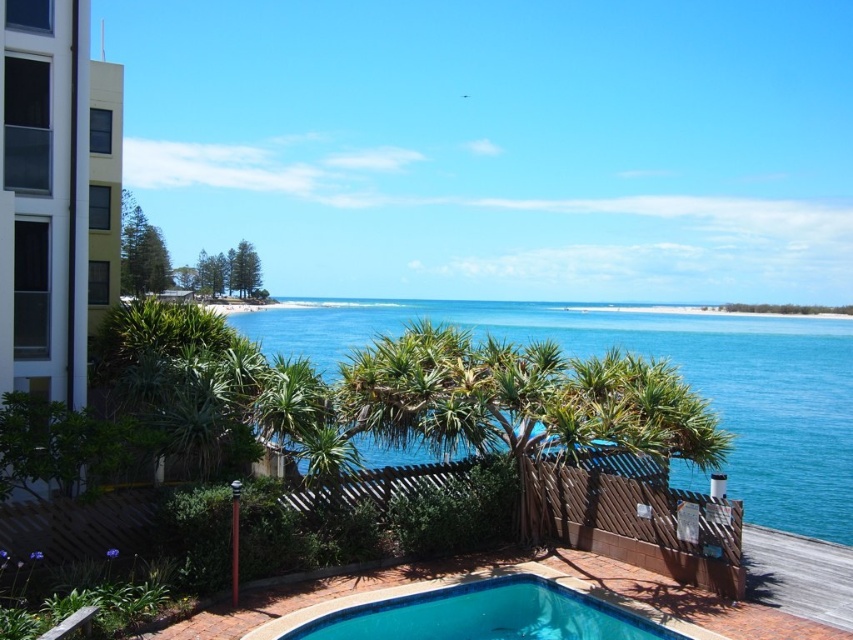
You are standing on the balcony and want to take a photo of the white glass building at left and the blue tile swimming pool at lower center. Which object should you point your camera upwards to capture?

You should point your camera upwards to capture the white glass building at left because it is located above the blue tile swimming pool at lower center.